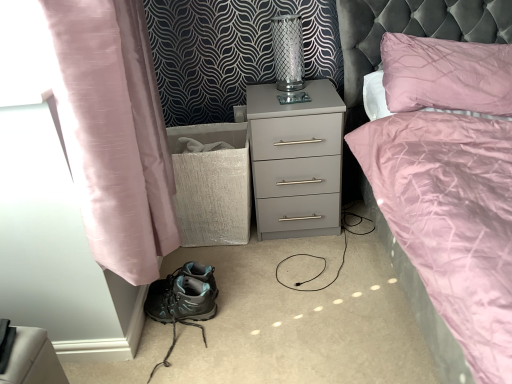
Identify the location of free space in front of clear glass vase at upper center. This screenshot has width=512, height=384. (286, 97).